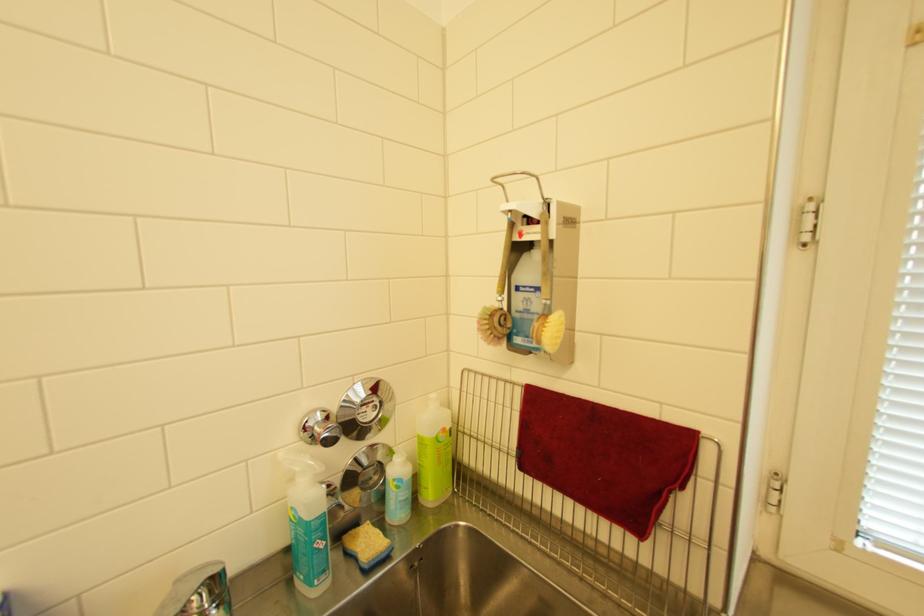
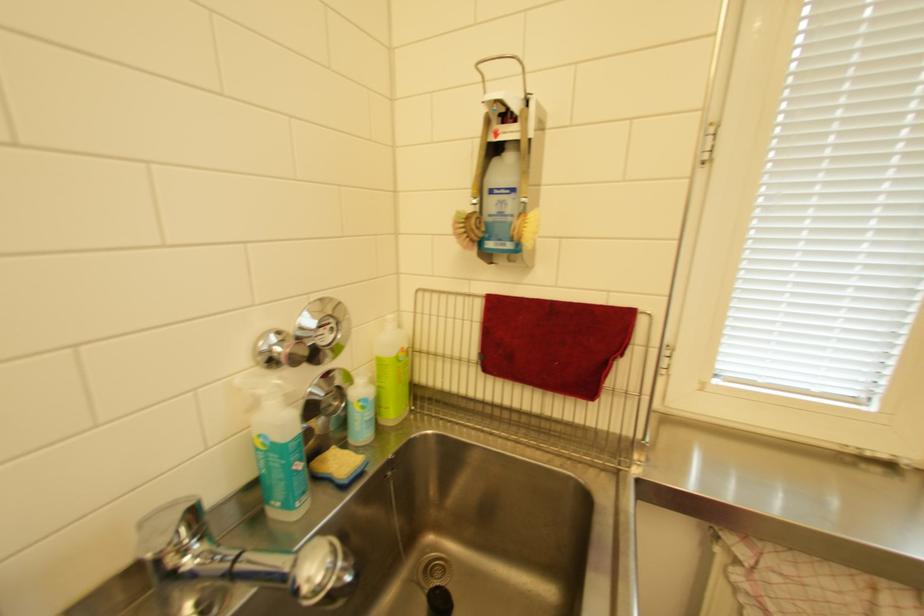
Locate, in the second image, the point that corresponds to (x=185, y=582) in the first image.

(150, 524)